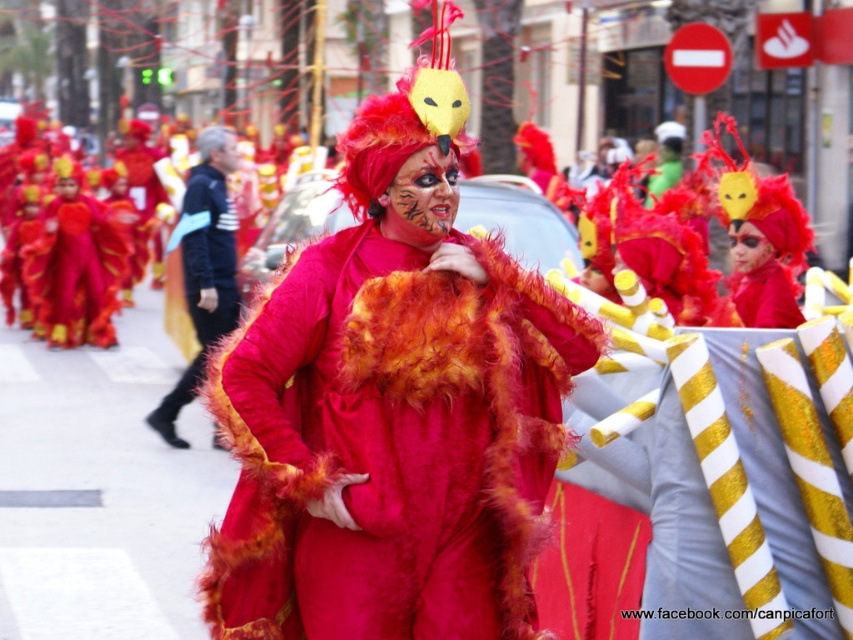
Measure the distance between fuzzy red costume at center and camera.

fuzzy red costume at center and camera are 5.38 meters apart from each other.

Which is in front, point (556, 458) or point (91, 260)?

Point (556, 458) is in front.

Where is `fuzzy red costume at center`? Image resolution: width=853 pixels, height=640 pixels. fuzzy red costume at center is located at coordinates (390, 444).

Who is shorter, matte black jacket at center or velvet red costume at center?

With less height is velvet red costume at center.

Is matte black jacket at center positioned behind velvet red costume at center?

No, matte black jacket at center is in front of velvet red costume at center.

The width and height of the screenshot is (853, 640). What do you see at coordinates (202, 266) in the screenshot?
I see `matte black jacket at center` at bounding box center [202, 266].

I want to click on matte black jacket at center, so click(x=202, y=266).

Does point (370, 304) lie in front of point (223, 134)?

That is True.

Image resolution: width=853 pixels, height=640 pixels. What do you see at coordinates (390, 444) in the screenshot?
I see `fuzzy red costume at center` at bounding box center [390, 444].

The width and height of the screenshot is (853, 640). I want to click on fuzzy red costume at center, so (x=390, y=444).